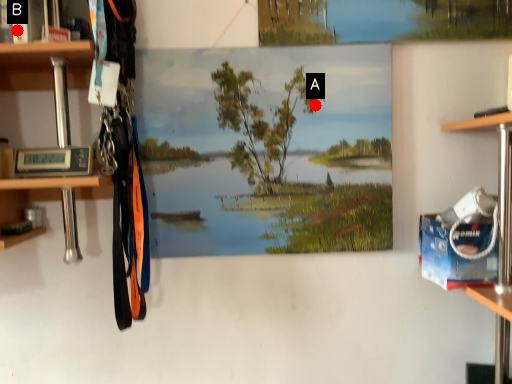
Question: Two points are circled on the image, labeled by A and B beside each circle. Which point is further to the camera?

Choices:
 (A) A is further
 (B) B is further

Answer: (A)